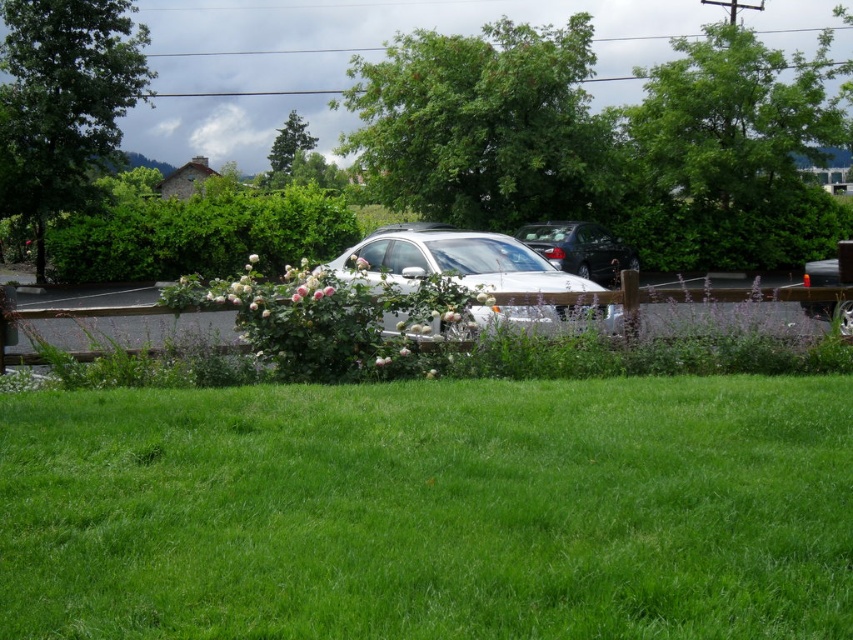
Between green grassy field at lower center and green leafy tree at upper left, which one is positioned lower?

green grassy field at lower center is below.

Between green grassy field at lower center and green leafy tree at upper left, which one is positioned higher?

green leafy tree at upper left is higher up.

Who is more distant from viewer, (252, 499) or (33, 125)?

Point (33, 125)

This screenshot has width=853, height=640. I want to click on green grassy field at lower center, so click(x=430, y=509).

Does point (552, 221) come farther from viewer compared to point (270, 172)?

No, it is in front of (270, 172).

Is satin black sedan at center above green textured tree at upper center?

Actually, satin black sedan at center is below green textured tree at upper center.

Between point (611, 260) and point (280, 138), which one is positioned behind?

Point (280, 138)

Identify the location of satin black sedan at center. This screenshot has width=853, height=640. (579, 248).

Between green leafy tree at upper center and satin white sedan at center, which one is positioned lower?

satin white sedan at center is lower down.

Who is more distant from viewer, (465, 204) or (527, 321)?

Positioned behind is point (465, 204).

I want to click on green leafy tree at upper center, so click(485, 125).

Where is `green leafy tree at upper center`? The height and width of the screenshot is (640, 853). green leafy tree at upper center is located at coordinates (485, 125).